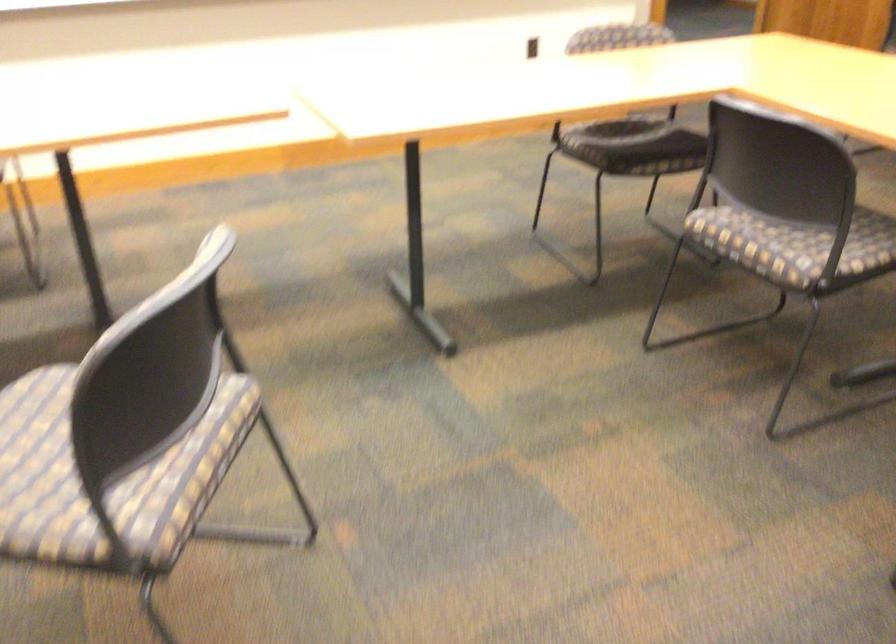
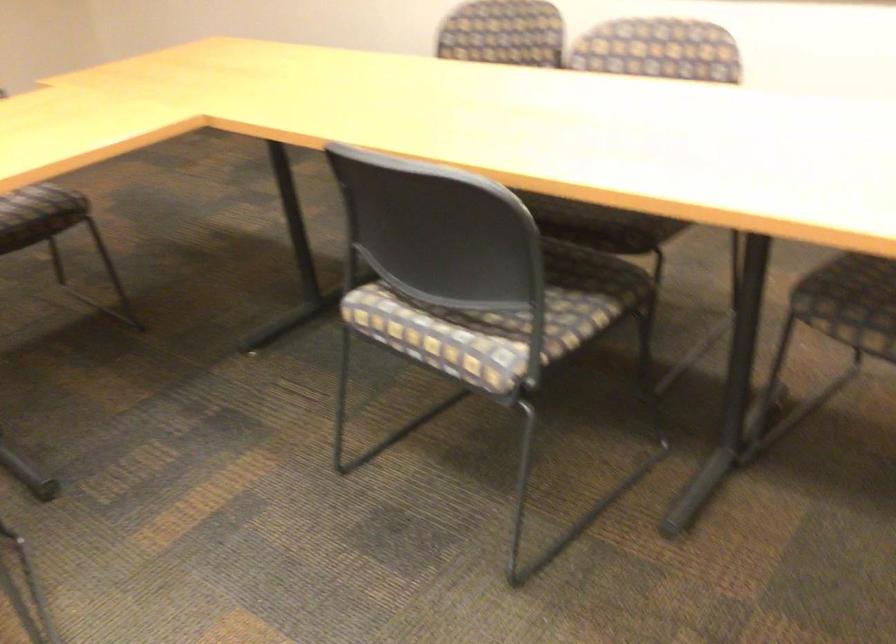
First-person continuous shooting, in which direction is the camera rotating?

The rotation direction of the camera is right-down.